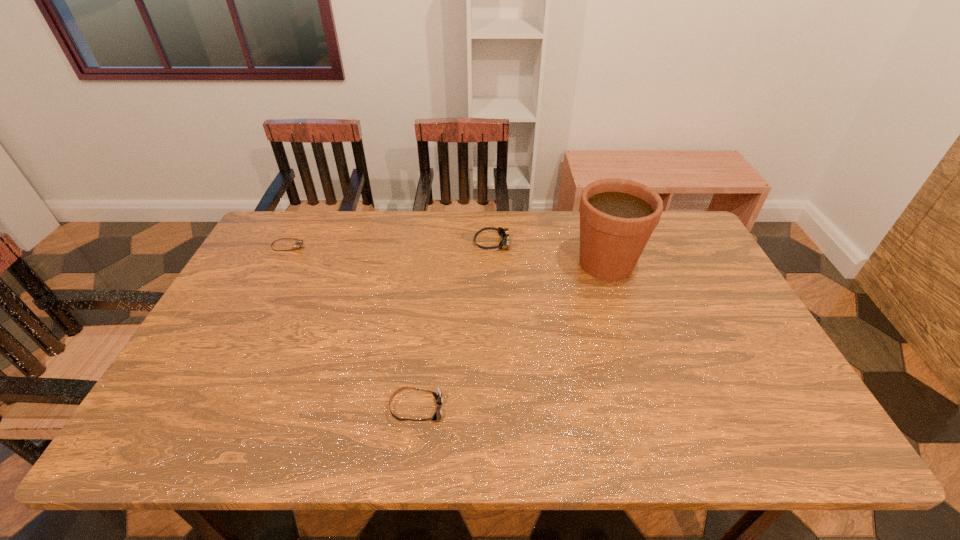
The height and width of the screenshot is (540, 960). I want to click on free space between the shortest object and the tallest goggles, so click(x=391, y=245).

Find the location of a particular element. Image resolution: width=960 pixels, height=540 pixels. empty location between the shortest object and the flowerpot is located at coordinates (447, 255).

You are a GUI agent. You are given a task and a screenshot of the screen. Output one action in this format:
    pyautogui.click(x=<x>, y=<y>)
    Task: Click on the object that can be found as the second closest to the third tallest object
    This screenshot has width=960, height=540.
    Given the screenshot: What is the action you would take?
    pyautogui.click(x=504, y=233)

Find the location of a particular element. the second closest object to the tallest goggles is located at coordinates (438, 395).

Where is `the second closest goggles to the second goggles from right to left`? The height and width of the screenshot is (540, 960). the second closest goggles to the second goggles from right to left is located at coordinates (299, 243).

Select which goggles is the closest to the rightmost object. Please provide its 2D coordinates. Your answer should be formatted as a tuple, i.e. [(x, y)], where the tuple contains the x and y coordinates of a point satisfying the conditions above.

[(504, 233)]

What are the coordinates of `vacant space that satisfies the following two spatial constraints: 1. on the back side of the flowerpot; 2. on the front lenses and sides of the leftmost object` in the screenshot? It's located at pyautogui.click(x=601, y=247).

Where is `vacant space that satisfies the following two spatial constraints: 1. on the front lenses and sides of the rightmost object; 2. on the right side of the shortest object`? Image resolution: width=960 pixels, height=540 pixels. vacant space that satisfies the following two spatial constraints: 1. on the front lenses and sides of the rightmost object; 2. on the right side of the shortest object is located at coordinates coord(280,264).

The width and height of the screenshot is (960, 540). What are the coordinates of `vacant space that satisfies the following two spatial constraints: 1. on the front lenses and sides of the shortest goggles; 2. on the left side of the flowerpot` in the screenshot? It's located at (280, 264).

Locate an element on the screen. This screenshot has height=540, width=960. free location that satisfies the following two spatial constraints: 1. on the back side of the rightmost object; 2. on the front lenses and sides of the shortest goggles is located at coordinates (601, 247).